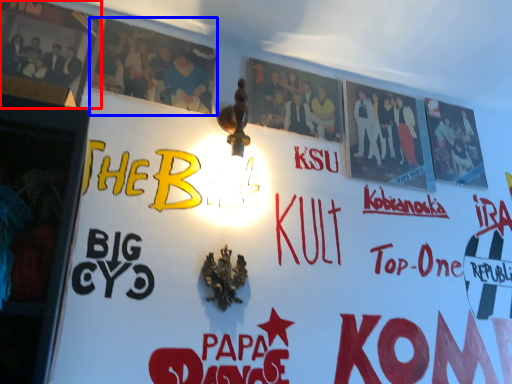
Question: Which object appears farthest to the camera in this image, poster (highlighted by a red box) or poster (highlighted by a blue box)?

Choices:
 (A) poster
 (B) poster

Answer: (B)